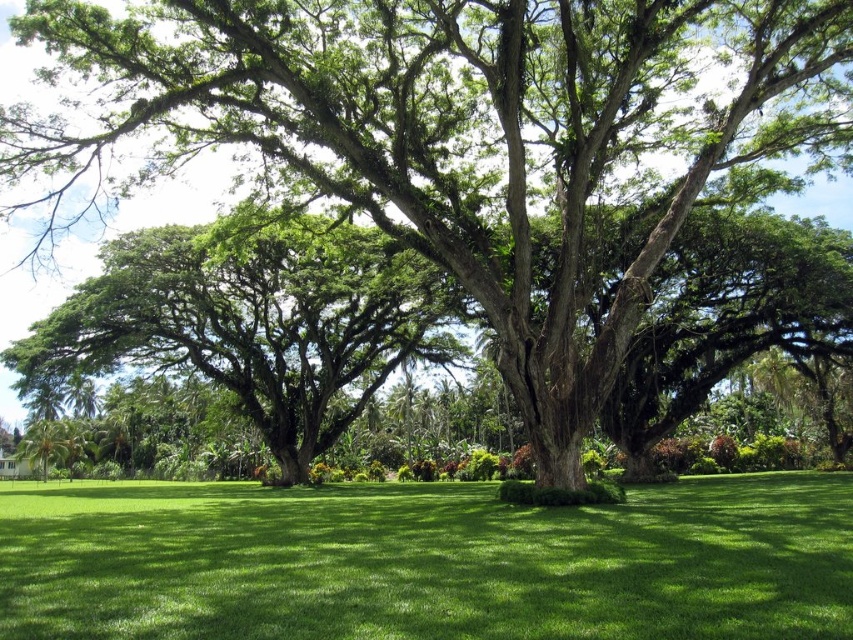
You are standing in the tropical landscape and want to find a spot where the green grass at center is not shaded by the green leafy tree at center. Where should you look?

The green grass at center is positioned under the green leafy tree at center, so it is shaded by it. To find an unshaded spot, look away from the area directly beneath the tree.

You are standing at the point marked as point (427, 563) in the tropical landscape. What surface are you currently standing on?

The point (427, 563) is on green grass at center, so you are standing on the green grass at center.

You are standing in the tropical landscape and want to walk from point A to point B. Point A is at coordinate point point (231, 515) and point B is at coordinate point point (157, 328). According to the scene description, which point is closer to you when you are facing the direction of the image?

Point point (231, 515) is in front of point point (157, 328), so when facing the image, point point (231, 515) is closer to you.